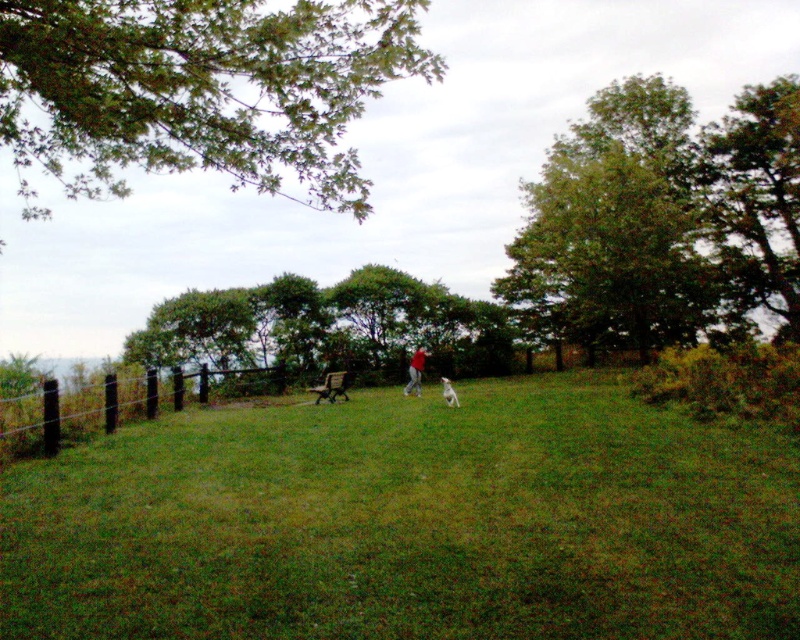
You are standing in the park scene described. There is a green leafy tree at upper right. Can you estimate the coordinates of the tree in the image?

The green leafy tree at upper right is located at coordinates point [756,196].

Consider the image. You are planning to fly a kite in the green grassy field at center. Considering the height of the green leafy tree at upper right, is there enough space for the kite string to avoid getting tangled in the tree?

The green grassy field at center is shorter than the green leafy tree at upper right, so the kite string may risk getting tangled in the tree if flown too high near it.

You are a photographer trying to capture a photo of the red matte shirt at center and the green leafy tree at upper right in the background. Which object should be placed to the right side of the other to frame the shot properly?

The green leafy tree at upper right should be placed to the right side of the red matte shirt at center to frame the shot properly since the green leafy tree at upper right is positioned on the right side of red matte shirt at center.